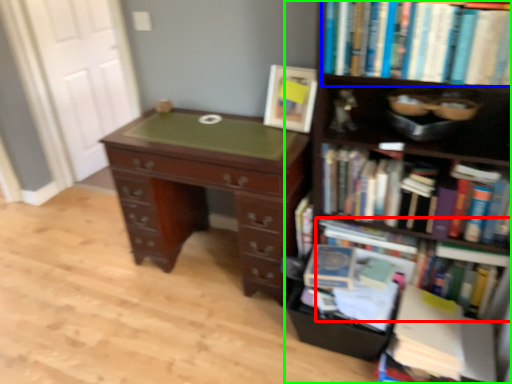
Question: Estimate the real-world distances between objects in this image. Which object is closer to book (highlighted by a red box), book (highlighted by a blue box) or bookcase (highlighted by a green box)?

Choices:
 (A) book
 (B) bookcase

Answer: (B)